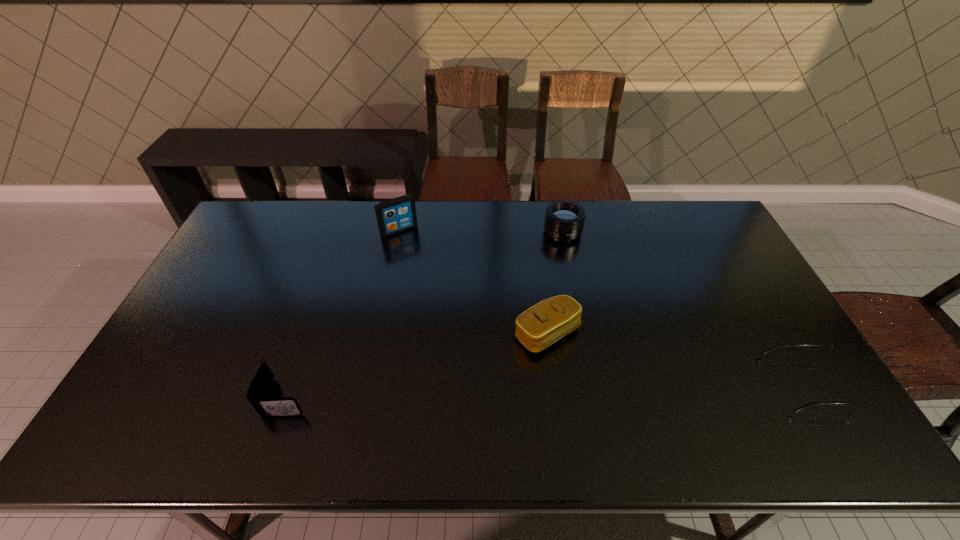
This screenshot has height=540, width=960. Find the location of `the third closest object relative to the telephoto lens`. the third closest object relative to the telephoto lens is located at coordinates (856, 393).

What are the coordinates of `vacant region that satisfies the following two spatial constraints: 1. on the back side of the clutch bag; 2. on the left side of the telephoto lens` in the screenshot? It's located at (534, 232).

This screenshot has width=960, height=540. In order to click on free space that satisfies the following two spatial constraints: 1. on the front side of the rightmost object; 2. at the hinge ends of the telephoto lens in this screenshot , I will do `click(594, 384)`.

The width and height of the screenshot is (960, 540). Find the location of `vacant space that satisfies the following two spatial constraints: 1. on the front side of the fourth object from right to left; 2. at the hinge ends of the spectacles`. vacant space that satisfies the following two spatial constraints: 1. on the front side of the fourth object from right to left; 2. at the hinge ends of the spectacles is located at coordinates (368, 384).

Where is `vacant area in the image that satisfies the following two spatial constraints: 1. on the front side of the telephoto lens; 2. at the hinge ends of the shortest object`? The width and height of the screenshot is (960, 540). vacant area in the image that satisfies the following two spatial constraints: 1. on the front side of the telephoto lens; 2. at the hinge ends of the shortest object is located at coordinates (594, 384).